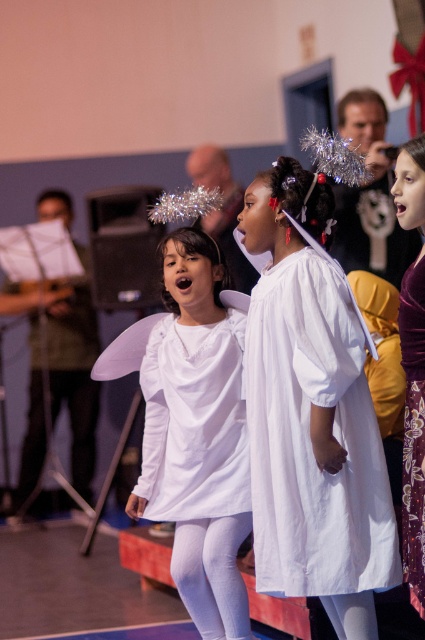
Between point (356, 513) and point (172, 417), which one is positioned in front?

Point (356, 513) is in front.

Measure the distance between white cotton dress at center and white matte dress at center.

A distance of 20.02 inches exists between white cotton dress at center and white matte dress at center.

The width and height of the screenshot is (425, 640). In order to click on white cotton dress at center in this screenshot , I will do `click(309, 436)`.

Locate an element on the screen. white cotton dress at center is located at coordinates (309, 436).

Based on the photo, does white cotton dress at center appear under velvet purple dress at right?

Yes, white cotton dress at center is below velvet purple dress at right.

Is white cotton dress at center thinner than velvet purple dress at right?

No, white cotton dress at center is not thinner than velvet purple dress at right.

Which is behind, point (280, 464) or point (396, 161)?

Point (396, 161)

You are a GUI agent. You are given a task and a screenshot of the screen. Output one action in this format:
    pyautogui.click(x=<x>, y=<y>)
    Task: Click on the white cotton dress at center
    The width and height of the screenshot is (425, 640).
    Given the screenshot: What is the action you would take?
    pyautogui.click(x=309, y=436)

Is white matte dress at center behind velvet purple dress at right?

Yes, white matte dress at center is behind velvet purple dress at right.

Is point (209, 328) farther from camera compared to point (405, 468)?

That is True.

This screenshot has height=640, width=425. What are the coordinates of `white matte dress at center` in the screenshot? It's located at coord(198,436).